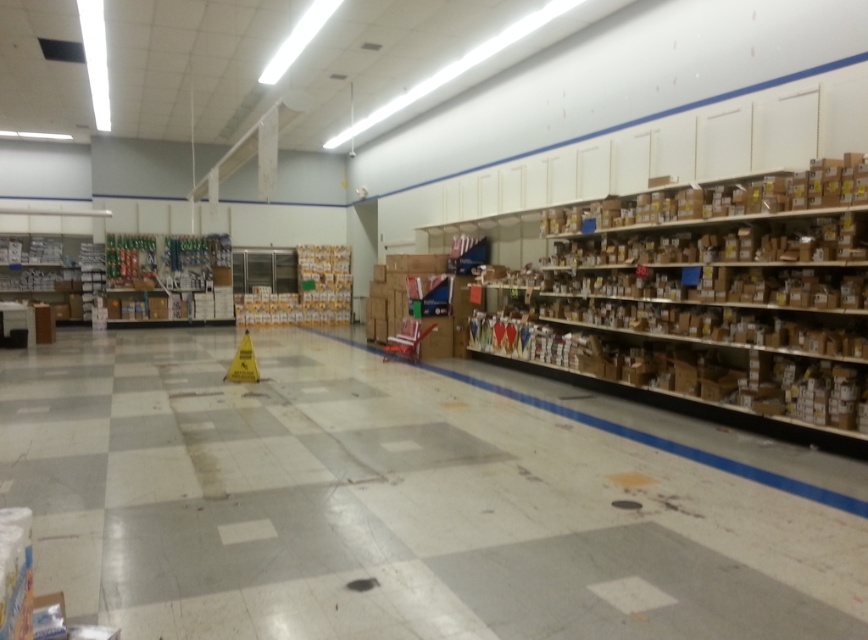
Question: Is white glossy floor at center above brown cardboard shelves at right?

Choices:
 (A) yes
 (B) no

Answer: (B)

Question: Which point appears closest to the camera in this image?

Choices:
 (A) (217, 513)
 (B) (666, 225)

Answer: (A)

Question: Considering the relative positions of white glossy floor at center and brown cardboard shelves at right in the image provided, where is white glossy floor at center located with respect to brown cardboard shelves at right?

Choices:
 (A) below
 (B) above

Answer: (A)

Question: Which point is farther to the camera?

Choices:
 (A) white glossy floor at center
 (B) brown cardboard shelves at right

Answer: (B)

Question: Can you confirm if white glossy floor at center is thinner than brown cardboard shelves at right?

Choices:
 (A) yes
 (B) no

Answer: (B)